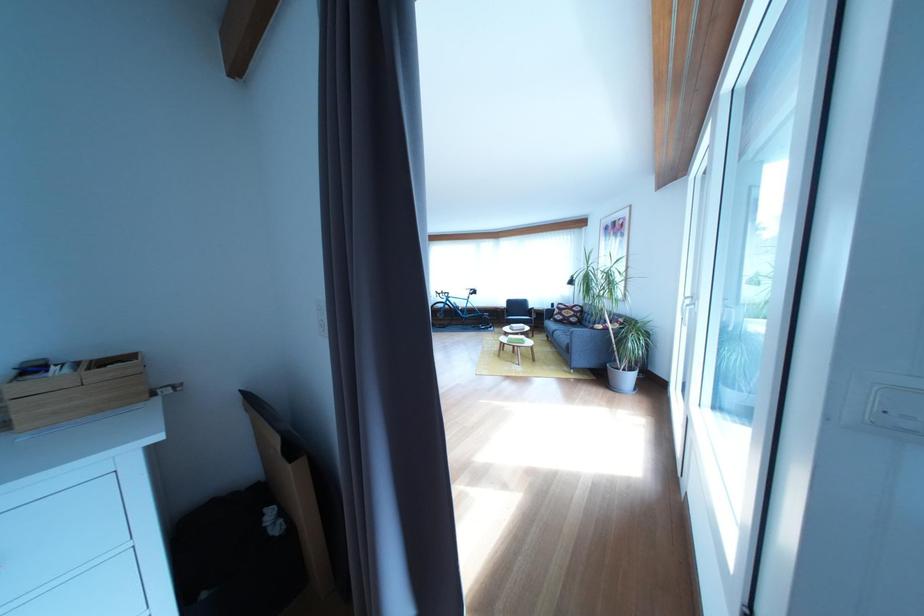
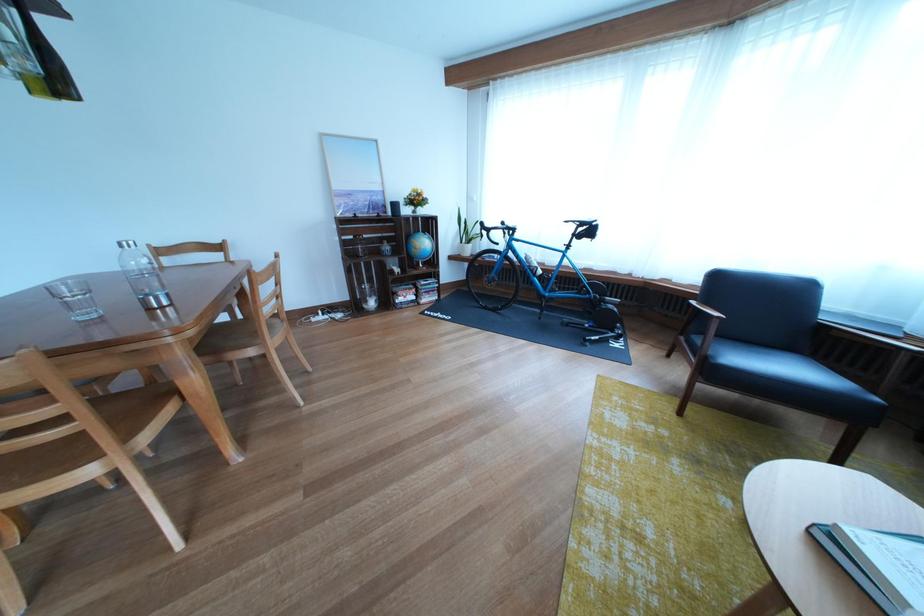
Question: What movement of the cameraman would produce the second image?

Choices:
 (A) Left
 (B) Right
 (C) Forward
 (D) Backward

Answer: (C)